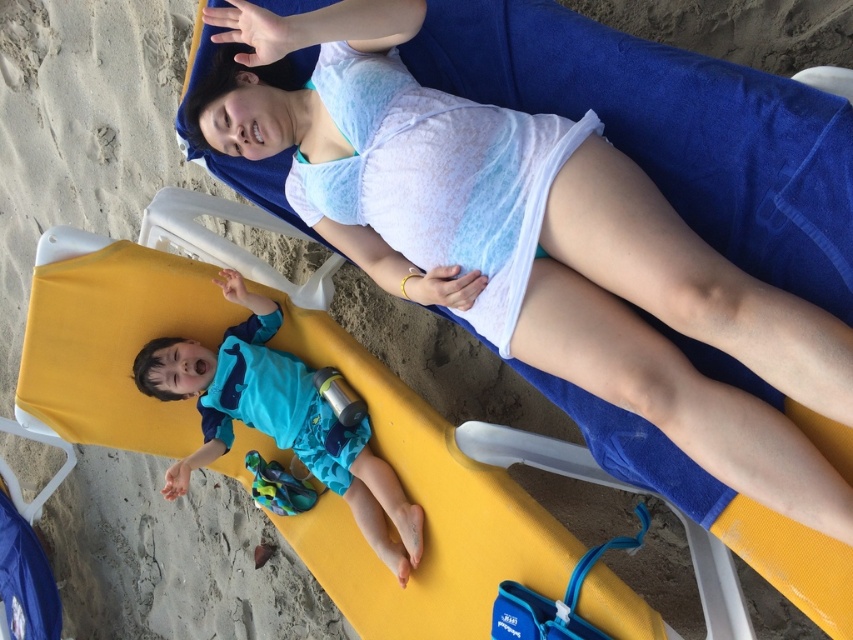
You are a photographer taking a picture of the beach scene. You need to adjust the camera to focus on both the blue fabric swimsuit at lower left and the blue fabric swimsuit at center. Which swimsuit is positioned to the right side of the other?

The blue fabric swimsuit at lower left is to the right of the blue fabric swimsuit at center.

You are a photographer taking a picture of the two people in the beach scene. You notice both the blue fabric swimsuit at lower left and the blue fabric swimsuit at center. Which swimsuit appears taller in the photo?

The blue fabric swimsuit at lower left appears taller than the blue fabric swimsuit at center in the photo because it is much taller as described.

You are a photographer taking a picture of the beach scene. The blue fabric swimsuit at lower left is represented by point [685,333]. Where should you focus your camera to capture the blue fabric swimsuit at lower left?

You should focus your camera on the point [685,333] to capture the blue fabric swimsuit at lower left.